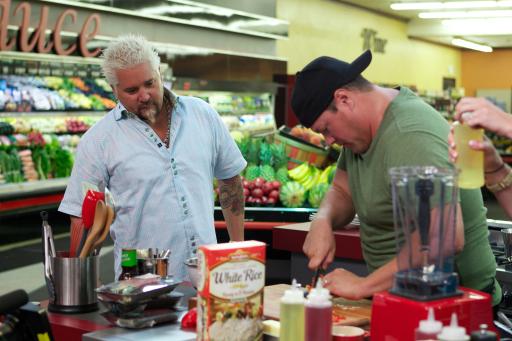
Where is `wooden spoon`? wooden spoon is located at coordinates (97, 219).